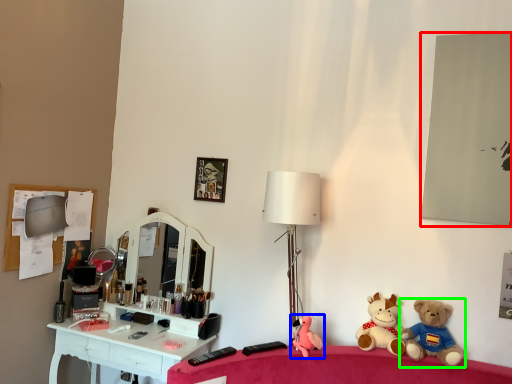
Question: Based on their relative distances, which object is nearer to mirror (highlighted by a red box)? Choose from toy (highlighted by a blue box) and toy (highlighted by a green box).

Choices:
 (A) toy
 (B) toy

Answer: (B)